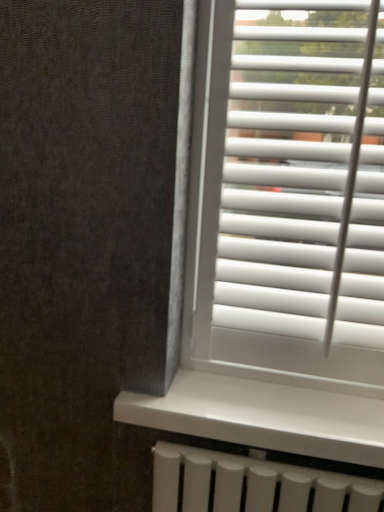
Question: Relative to white plastic blinds at right, is white smooth window sill at center in front or behind?

Choices:
 (A) front
 (B) behind

Answer: (B)

Question: Based on their positions, is white smooth window sill at center located to the left or right of white plastic blinds at right?

Choices:
 (A) right
 (B) left

Answer: (B)

Question: From the image's perspective, is white smooth window sill at center positioned above or below white plastic blinds at right?

Choices:
 (A) above
 (B) below

Answer: (B)

Question: From a real-world perspective, relative to white smooth window sill at center, is white plastic blinds at right vertically above or below?

Choices:
 (A) below
 (B) above

Answer: (B)

Question: Would you say white plastic blinds at right is inside or outside white smooth window sill at center?

Choices:
 (A) outside
 (B) inside

Answer: (A)

Question: Considering the positions of white plastic blinds at right and white smooth window sill at center in the image, is white plastic blinds at right wider or thinner than white smooth window sill at center?

Choices:
 (A) thin
 (B) wide

Answer: (A)

Question: Is white plastic blinds at right taller or shorter than white smooth window sill at center?

Choices:
 (A) short
 (B) tall

Answer: (B)